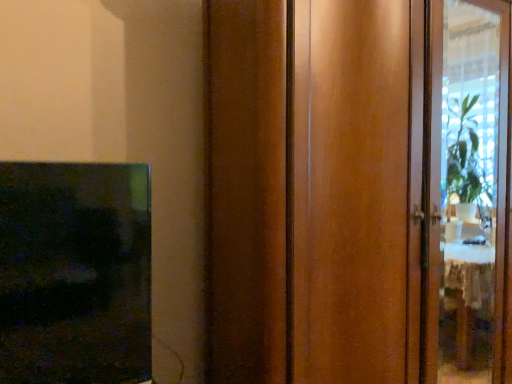
What are the coordinates of `matte black picture frame at left` in the screenshot? It's located at (74, 273).

In the scene shown: In order to face matte black picture frame at left, should I rotate leftwards or rightwards?

To face it directly, rotate left by 22.499 degrees.

This screenshot has height=384, width=512. Describe the element at coordinates (74, 273) in the screenshot. I see `matte black picture frame at left` at that location.

You are a GUI agent. You are given a task and a screenshot of the screen. Output one action in this format:
    pyautogui.click(x=<x>, y=<y>)
    Task: Click on the matte black picture frame at left
    This screenshot has width=512, height=384.
    Given the screenshot: What is the action you would take?
    click(x=74, y=273)